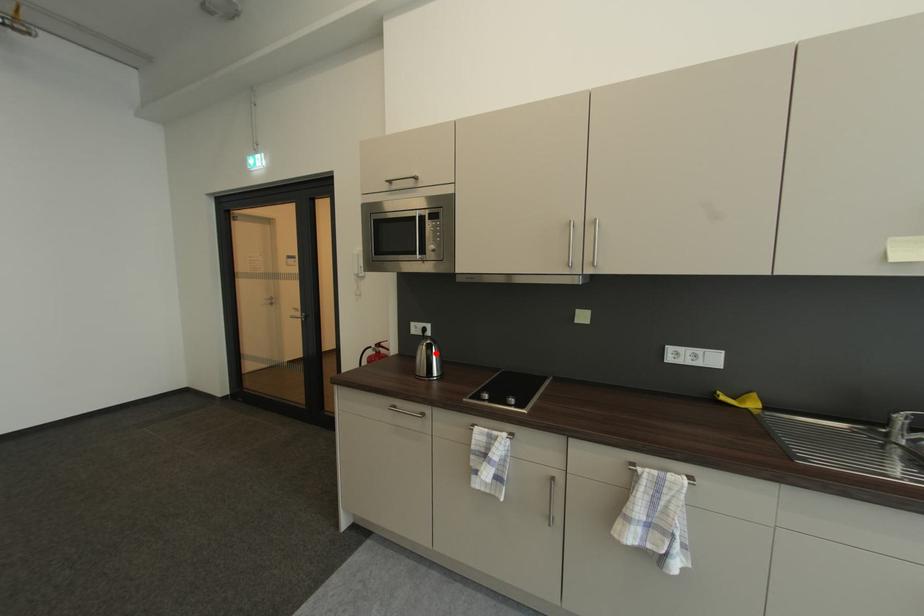
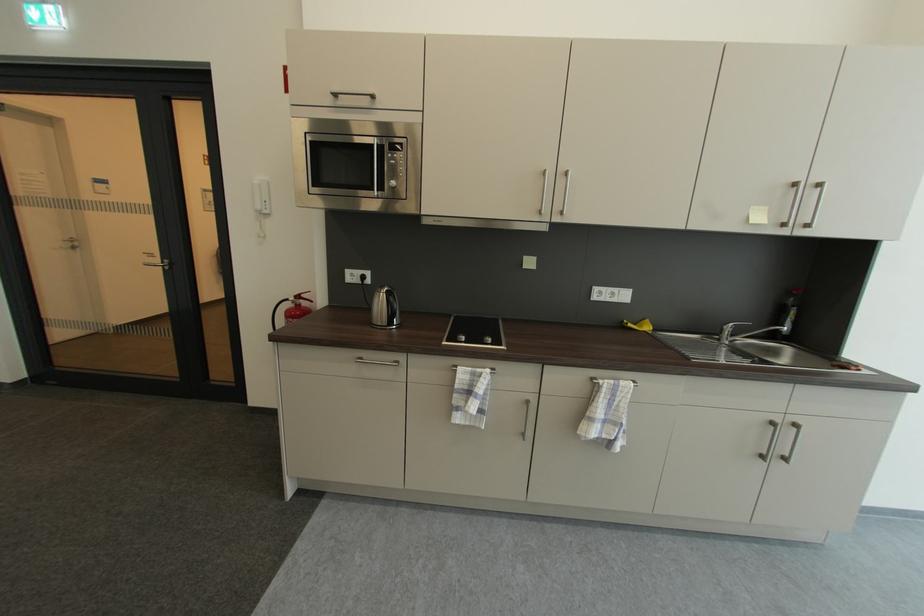
Question: A red point is marked in image1. In image2, is the corresponding 3D point closer to the camera or farther? Reply with the corresponding letter.

Choices:
 (A) The corresponding 3D point is closer.
 (B) The corresponding 3D point is farther.

Answer: (A)